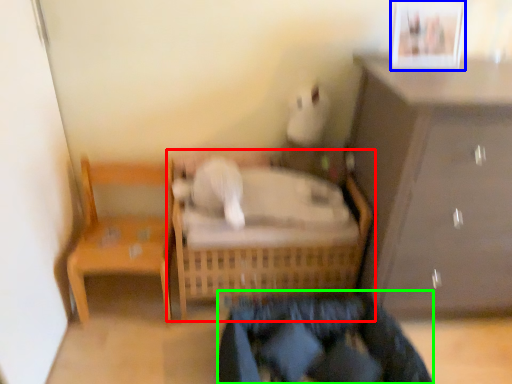
Question: Estimate the real-world distances between objects in this image. Which object is closer to furniture (highlighted by a red box), picture frame (highlighted by a blue box) or clothing (highlighted by a green box)?

Choices:
 (A) picture frame
 (B) clothing

Answer: (B)